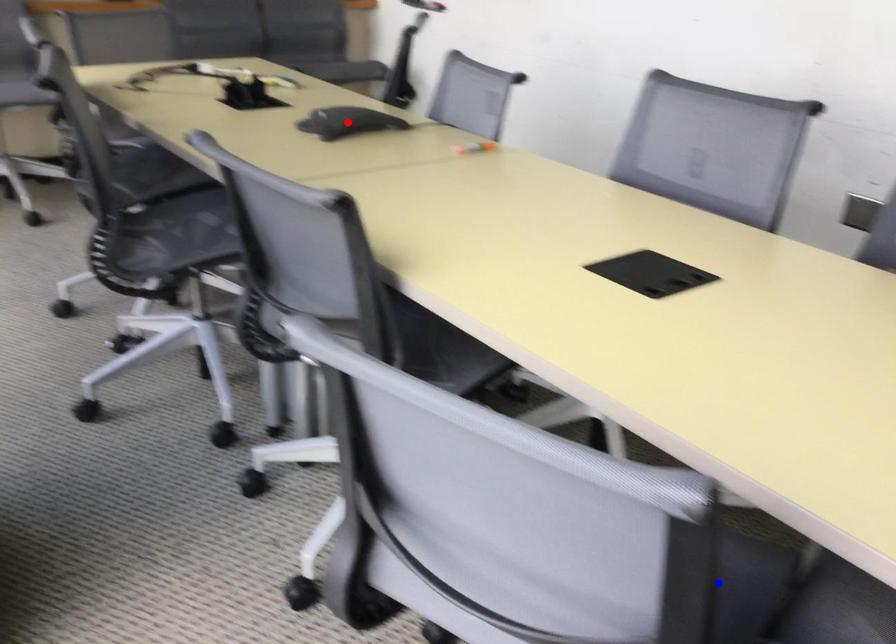
Question: Two points are marked on the image. Which point is closer to the camera?

Choices:
 (A) Blue point is closer.
 (B) Red point is closer.

Answer: (A)